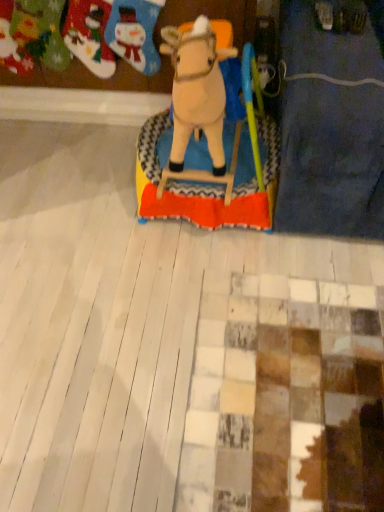
Question: Would you say felt stocking at upper left, which is the 2th toy from left to right, is inside or outside felt stockings at upper left, placed as the first toy when sorted from left to right?

Choices:
 (A) outside
 (B) inside

Answer: (A)

Question: In the image, is felt stocking at upper left, arranged as the second toy when viewed from the right, positioned in front of or behind felt stockings at upper left, placed as the third toy when sorted from right to left?

Choices:
 (A) front
 (B) behind

Answer: (A)

Question: Which object is positioned closest to the beige plush horse at center, the 3th toy in the left-to-right sequence?

Choices:
 (A) felt stockings at upper left, placed as the first toy when sorted from left to right
 (B) felt stocking at upper left, which is the 2th toy from left to right

Answer: (B)

Question: Which of these objects is positioned closest to the felt stocking at upper left, which is the 2th toy from left to right?

Choices:
 (A) beige plush horse at center, the 3th toy in the left-to-right sequence
 (B) felt stockings at upper left, placed as the third toy when sorted from right to left

Answer: (B)